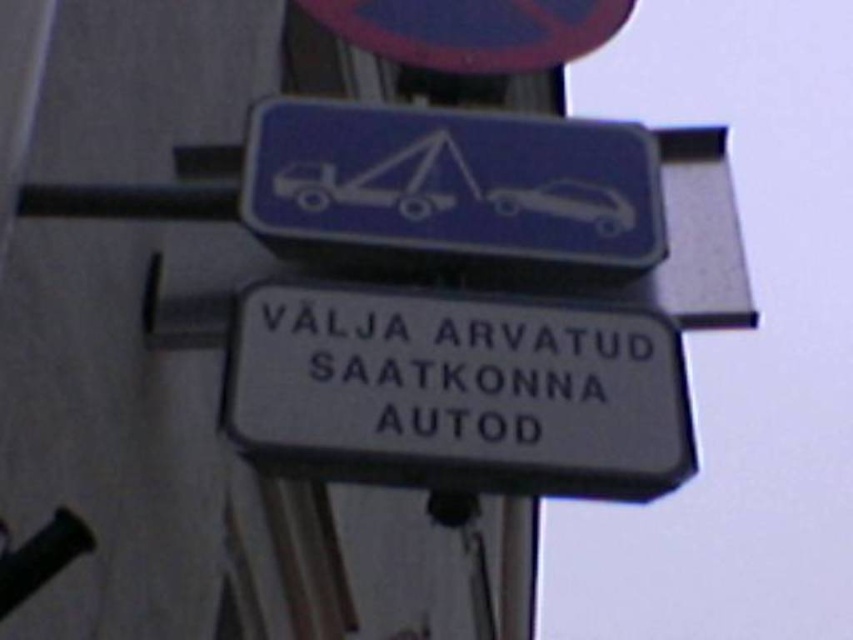
Question: Which of the following is the farthest from the observer?

Choices:
 (A) (444, 193)
 (B) (341, 369)
 (C) (589, 6)

Answer: (C)

Question: Is blue glossy tow truck at upper center wider than blue plastic sign at upper center?

Choices:
 (A) yes
 (B) no

Answer: (A)

Question: Does white plastic sign at center appear under white glossy car at upper center?

Choices:
 (A) no
 (B) yes

Answer: (B)

Question: Considering the relative positions of white plastic sign at center and blue plastic sign at upper center in the image provided, where is white plastic sign at center located with respect to blue plastic sign at upper center?

Choices:
 (A) above
 (B) below

Answer: (B)

Question: Which point appears closest to the camera in this image?

Choices:
 (A) (490, 148)
 (B) (299, 454)
 (C) (579, 189)

Answer: (B)

Question: Based on their relative distances, which object is nearer to the blue glossy tow truck at upper center?

Choices:
 (A) white glossy car at upper center
 (B) blue plastic sign at upper center

Answer: (A)